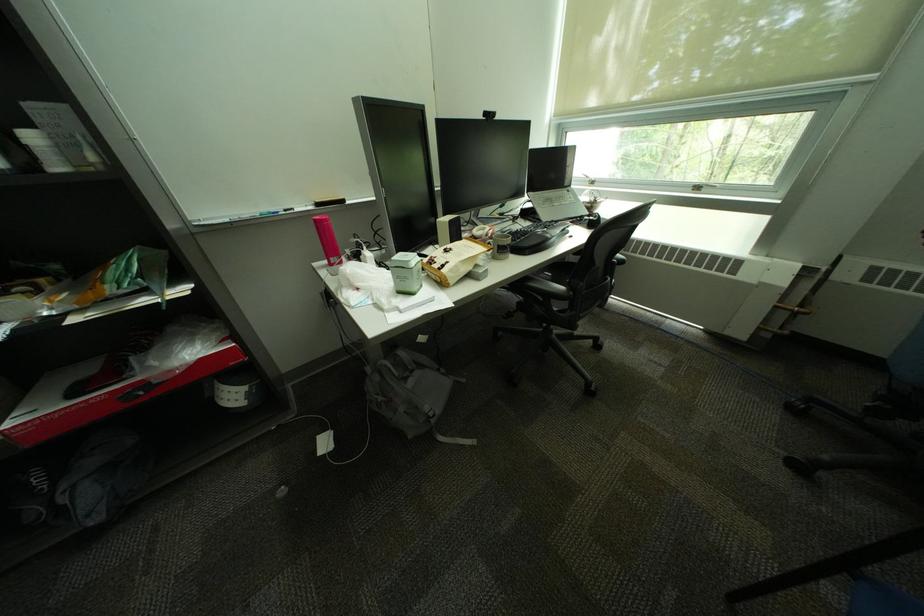
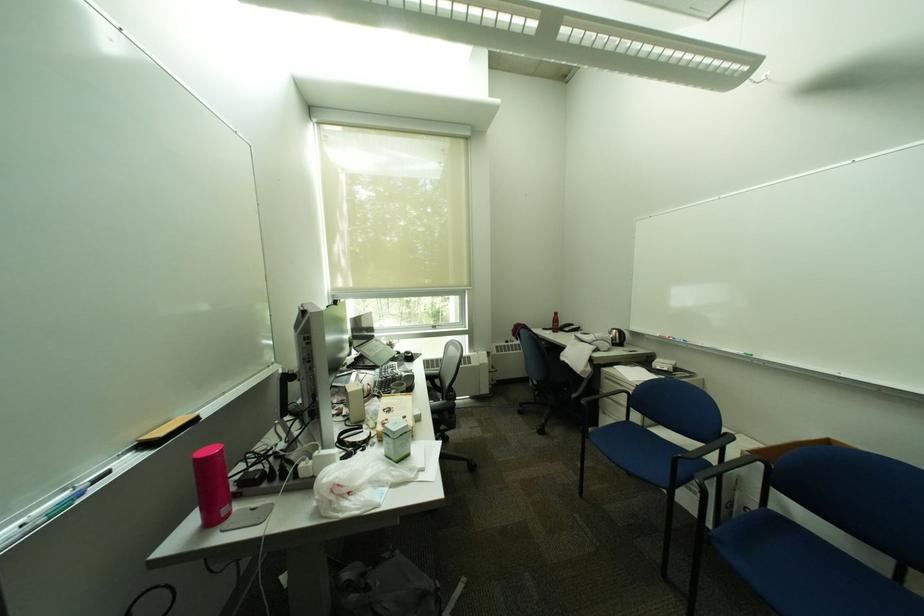
In the second image, find the point that corresponds to (323,222) in the first image.

(202, 464)